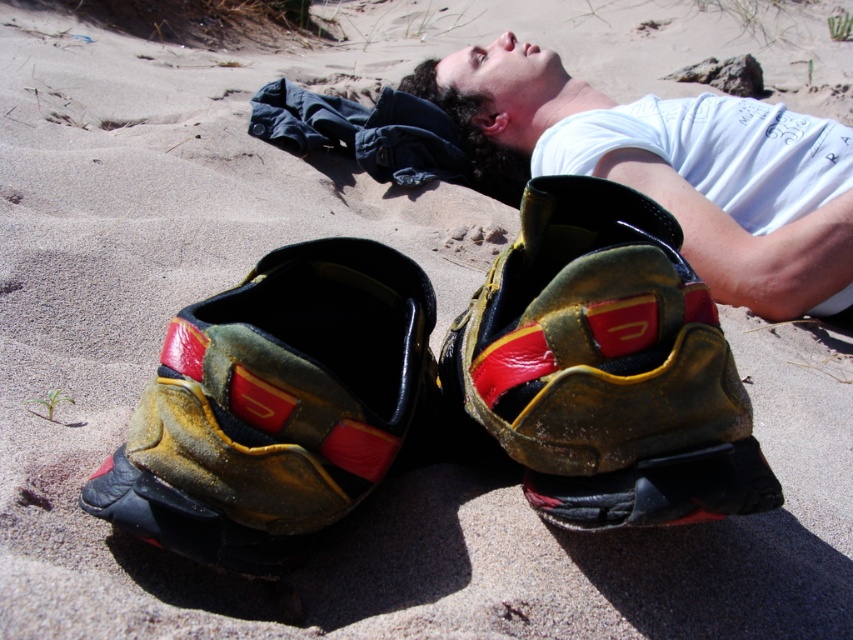
Question: From the image, what is the correct spatial relationship of yellow leather shoe at lower left in relation to matte white t-shirt at upper right?

Choices:
 (A) left
 (B) right

Answer: (A)

Question: Among these objects, which one is farthest from the camera?

Choices:
 (A) yellow leather shoe at lower left
 (B) matte white t-shirt at upper right

Answer: (B)

Question: Based on their relative distances, which object is nearer to the matte white t-shirt at upper right?

Choices:
 (A) yellow-green leather shoe at center
 (B) yellow leather shoe at lower left

Answer: (A)

Question: Which point is closer to the camera?

Choices:
 (A) (389, 449)
 (B) (505, 52)
 (C) (698, 397)

Answer: (C)

Question: Is yellow-green leather shoe at center bigger than matte white t-shirt at upper right?

Choices:
 (A) no
 (B) yes

Answer: (A)

Question: Can you confirm if yellow-green leather shoe at center is bigger than yellow leather shoe at lower left?

Choices:
 (A) yes
 (B) no

Answer: (A)